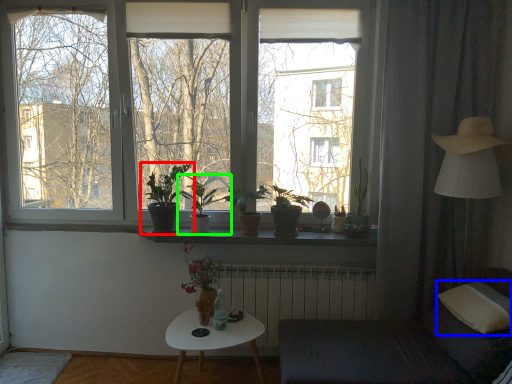
Question: Estimate the real-world distances between objects in this image. Which object is closer to houseplant (highlighted by a red box), pillow (highlighted by a blue box) or houseplant (highlighted by a green box)?

Choices:
 (A) pillow
 (B) houseplant

Answer: (B)